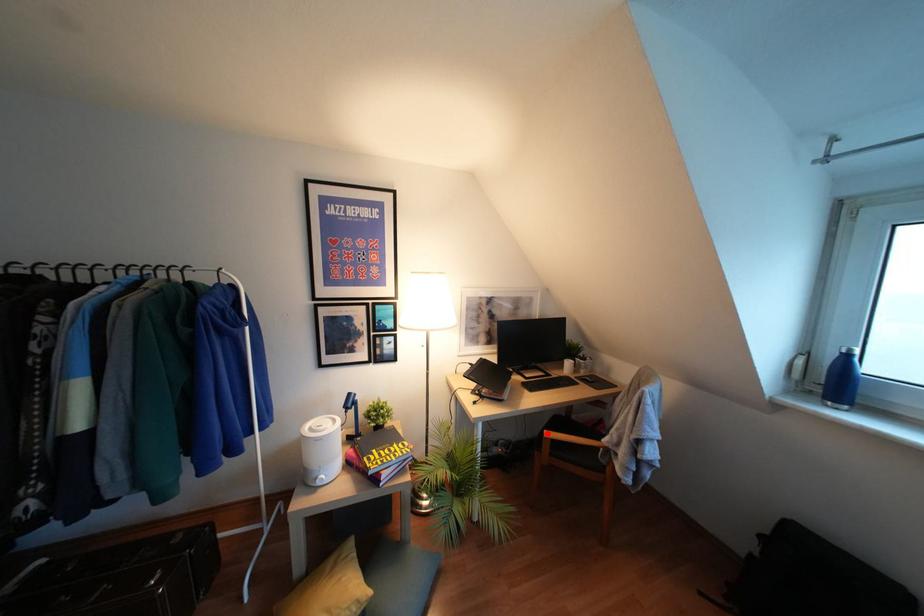
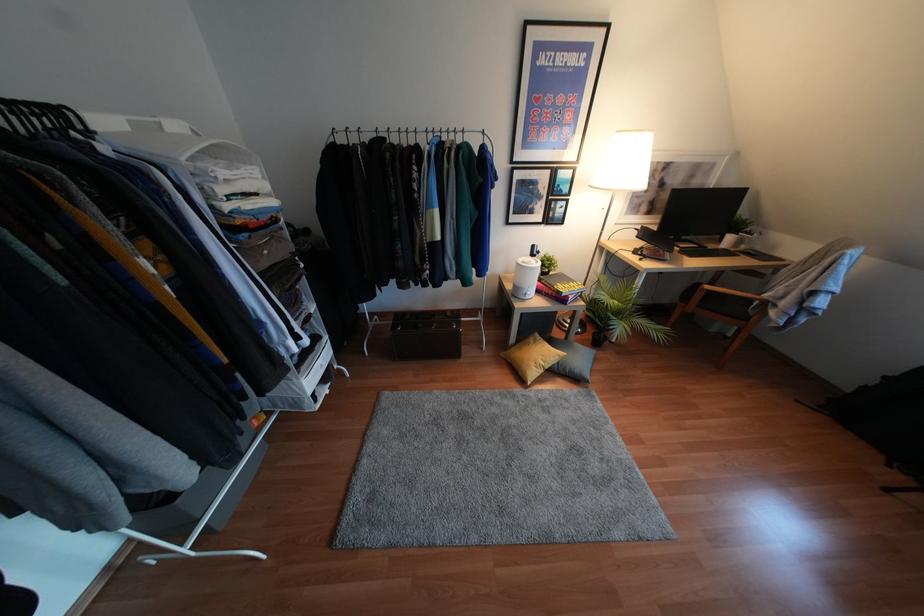
Where in the second image is the point corresponding to the highlighted location from the first image?

(707, 286)